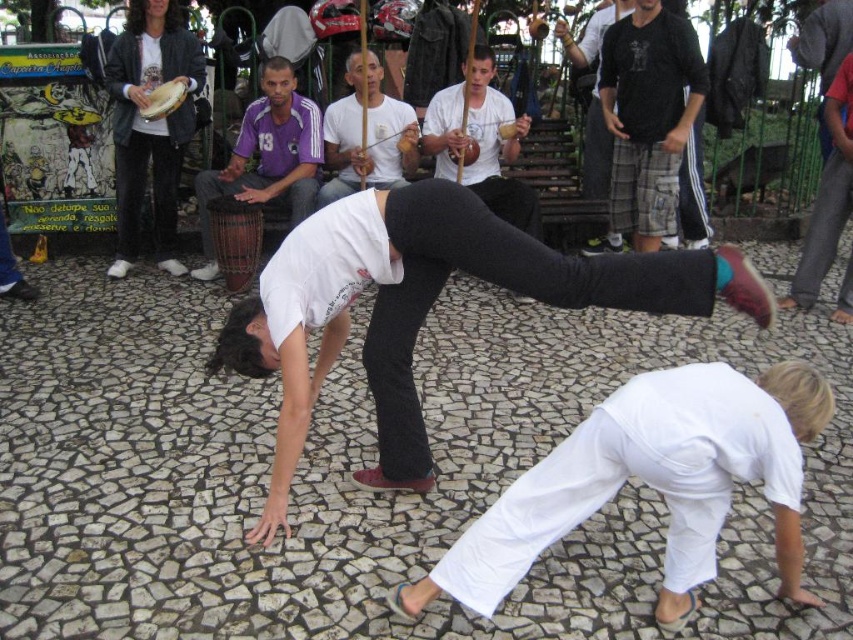
You are a photographer trying to capture the capoeira performers. You notice the matte black pants at center and the white cotton shirt at center. Which item should you focus on if you want to frame a wider subject in your shot?

The matte black pants at center should be focused on because its width surpasses that of the white cotton shirt at center, making it a wider subject to frame.

You are standing in the outdoor scene and want to place a small flag at the point closer to you between point (518, 196) and point (340, 124). Which point should you choose?

You should choose point (518, 196) because it is closer to the viewer than point (340, 124).